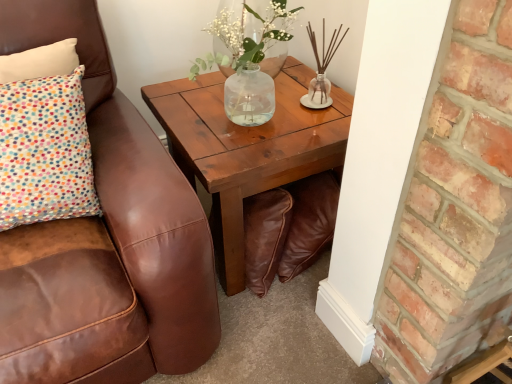
I want to click on wooden coffee table at center, so click(246, 149).

What do you see at coordinates (246, 149) in the screenshot? The width and height of the screenshot is (512, 384). I see `wooden coffee table at center` at bounding box center [246, 149].

Describe the element at coordinates (247, 36) in the screenshot. This screenshot has height=384, width=512. I see `translucent glass vase at upper center` at that location.

Identify the location of translucent glass vase at upper center. (247, 36).

In order to face translucent glass vase at upper center, should I rotate leftwards or rightwards?

To face it directly, rotate left by 0.906 degrees.

Identify the location of wooden coffee table at center. (246, 149).

Would you say wooden coffee table at center is to the left or to the right of translucent glass vase at upper center in the picture?

wooden coffee table at center is to the right of translucent glass vase at upper center.

Based on the photo, is wooden coffee table at center behind translucent glass vase at upper center?

No.

Does point (192, 157) lie behind point (253, 27)?

That is False.

From the image's perspective, which one is positioned lower, wooden coffee table at center or translucent glass vase at upper center?

wooden coffee table at center, from the image's perspective.

Consider the image. From a real-world perspective, is wooden coffee table at center located higher than translucent glass vase at upper center?

Incorrect, from a real-world perspective, wooden coffee table at center is lower than translucent glass vase at upper center.

Considering the sizes of wooden coffee table at center and translucent glass vase at upper center in the image, is wooden coffee table at center wider or thinner than translucent glass vase at upper center?

wooden coffee table at center is wider than translucent glass vase at upper center.

Does wooden coffee table at center have a lesser height compared to translucent glass vase at upper center?

No, wooden coffee table at center is not shorter than translucent glass vase at upper center.

Looking at the image, does wooden coffee table at center seem bigger or smaller compared to translucent glass vase at upper center?

Clearly, wooden coffee table at center is larger in size than translucent glass vase at upper center.

Is translucent glass vase at upper center completely or partially inside wooden coffee table at center?

No, wooden coffee table at center does not contain translucent glass vase at upper center.

Are wooden coffee table at center and translucent glass vase at upper center far apart?

No, wooden coffee table at center is in close proximity to translucent glass vase at upper center.

Is wooden coffee table at center facing away from translucent glass vase at upper center?

No.

How many degrees apart are the facing directions of wooden coffee table at center and translucent glass vase at upper center?

There is a 0.443-degree angle between the facing directions of wooden coffee table at center and translucent glass vase at upper center.

How much distance is there between wooden coffee table at center and translucent glass vase at upper center?

wooden coffee table at center and translucent glass vase at upper center are 24.10 centimeters apart from each other.

Locate an element on the screen. The width and height of the screenshot is (512, 384). coffee table directly beneath the translucent glass vase at upper center (from a real-world perspective) is located at coordinates (246, 149).

Between translucent glass vase at upper center and wooden coffee table at center, which one appears on the right side from the viewer's perspective?

wooden coffee table at center.

Does translucent glass vase at upper center lie behind wooden coffee table at center?

Yes, translucent glass vase at upper center is further from the camera.

Does point (257, 20) appear closer or farther from the camera than point (315, 168)?

Point (257, 20) appears to be farther away from the viewer than point (315, 168).

Consider the image. From the image's perspective, is translucent glass vase at upper center above wooden coffee table at center?

Correct, translucent glass vase at upper center appears higher than wooden coffee table at center in the image.

From a real-world perspective, is translucent glass vase at upper center physically above wooden coffee table at center?

Yes.

Is translucent glass vase at upper center wider or thinner than wooden coffee table at center?

Considering their sizes, translucent glass vase at upper center looks slimmer than wooden coffee table at center.

Is translucent glass vase at upper center taller than wooden coffee table at center?

In fact, translucent glass vase at upper center may be shorter than wooden coffee table at center.

Does translucent glass vase at upper center have a larger size compared to wooden coffee table at center?

Actually, translucent glass vase at upper center might be smaller than wooden coffee table at center.

Which is correct: translucent glass vase at upper center is inside wooden coffee table at center, or outside of it?

translucent glass vase at upper center is outside wooden coffee table at center.

Is translucent glass vase at upper center next to wooden coffee table at center?

No, translucent glass vase at upper center is not in contact with wooden coffee table at center.

Consider the image. Is wooden coffee table at center at the back of translucent glass vase at upper center?

That's not correct — translucent glass vase at upper center is not looking away from wooden coffee table at center.

How distant is translucent glass vase at upper center from wooden coffee table at center?

translucent glass vase at upper center and wooden coffee table at center are 9.49 inches apart.

Find the location of a particular element. floral arrangement located on the left of wooden coffee table at center is located at coordinates (247, 36).

Locate an element on the screen. The image size is (512, 384). floral arrangement that appears behind the wooden coffee table at center is located at coordinates (247, 36).

Where is `floral arrangement that is on the left side of wooden coffee table at center`? floral arrangement that is on the left side of wooden coffee table at center is located at coordinates (247, 36).